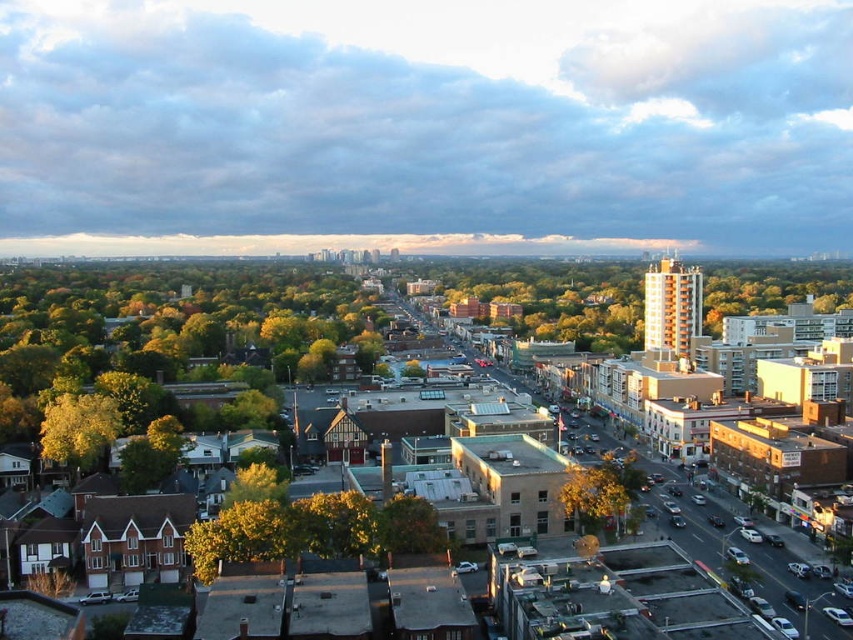
Which of these two, orange brick building at center-right or yellow-green leaves at center, stands shorter?

Standing shorter between the two is yellow-green leaves at center.

Does orange brick building at center-right appear on the right side of yellow-green leaves at center?

Answer: Correct, you'll find orange brick building at center-right to the right of yellow-green leaves at center.

Where is `orange brick building at center-right`? The image size is (853, 640). orange brick building at center-right is located at coordinates (556, 300).

Where is `orange brick building at center-right`? This screenshot has height=640, width=853. orange brick building at center-right is located at coordinates (556, 300).

Is green leafy tree at lower left bigger than yellow-green leaves at left?

Yes.

Which of these two, green leafy tree at lower left or yellow-green leaves at left, stands taller?

Standing taller between the two is green leafy tree at lower left.

Is point (12, 426) farther from camera compared to point (82, 452)?

Yes, it is.

In order to click on green leafy tree at lower left in this screenshot , I will do `click(173, 339)`.

Which is below, orange brick building at center-right or yellow-green leaves at left?

yellow-green leaves at left is lower down.

This screenshot has height=640, width=853. Describe the element at coordinates (556, 300) in the screenshot. I see `orange brick building at center-right` at that location.

Is point (454, 300) positioned after point (100, 396)?

Yes, it is.

I want to click on orange brick building at center-right, so click(x=556, y=300).